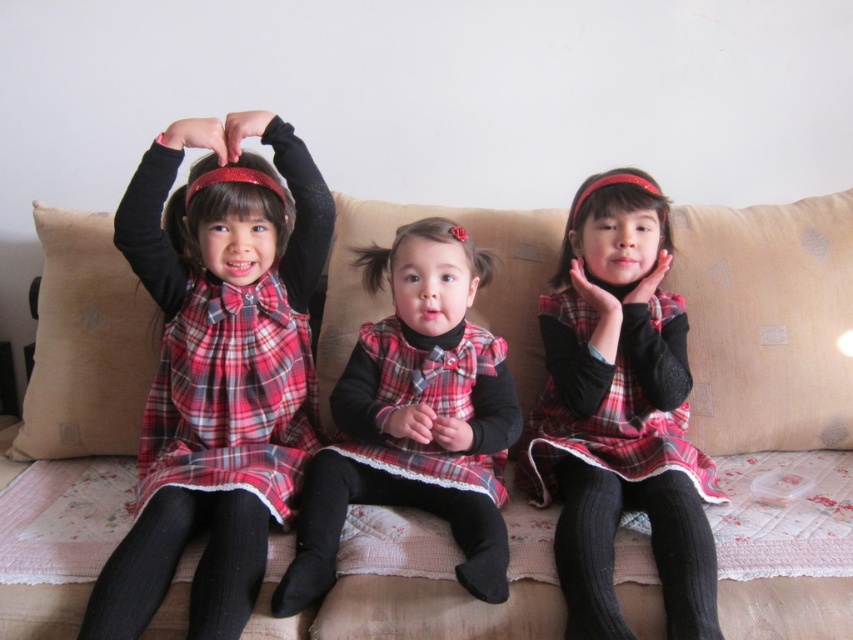
Does beige fabric couch at center have a smaller size compared to black ribbed sock at lower right?

Actually, beige fabric couch at center might be larger than black ribbed sock at lower right.

Which is in front, point (20, 592) or point (564, 582)?

Point (20, 592) is in front.

Where is `beige fabric couch at center`? Image resolution: width=853 pixels, height=640 pixels. beige fabric couch at center is located at coordinates (767, 323).

Find the location of a particular element. beige fabric couch at center is located at coordinates click(767, 323).

Between point (126, 305) and point (590, 380), which one is positioned behind?

The point (126, 305) is more distant.

What do you see at coordinates (767, 323) in the screenshot? The width and height of the screenshot is (853, 640). I see `beige fabric couch at center` at bounding box center [767, 323].

Is point (717, 227) behind point (585, 273)?

Yes, it is behind point (585, 273).

The height and width of the screenshot is (640, 853). Identify the location of beige fabric couch at center. (767, 323).

Does plaid fabric dress at left have a smaller size compared to black ribbed stocking at center?

Indeed, plaid fabric dress at left has a smaller size compared to black ribbed stocking at center.

Is plaid fabric dress at left to the right of black ribbed stocking at center from the viewer's perspective?

No, plaid fabric dress at left is not to the right of black ribbed stocking at center.

You are a GUI agent. You are given a task and a screenshot of the screen. Output one action in this format:
    pyautogui.click(x=<x>, y=<y>)
    Task: Click on the plaid fabric dress at left
    
    Given the screenshot: What is the action you would take?
    pyautogui.click(x=218, y=369)

Where is `plaid fabric dress at left`? plaid fabric dress at left is located at coordinates (218, 369).